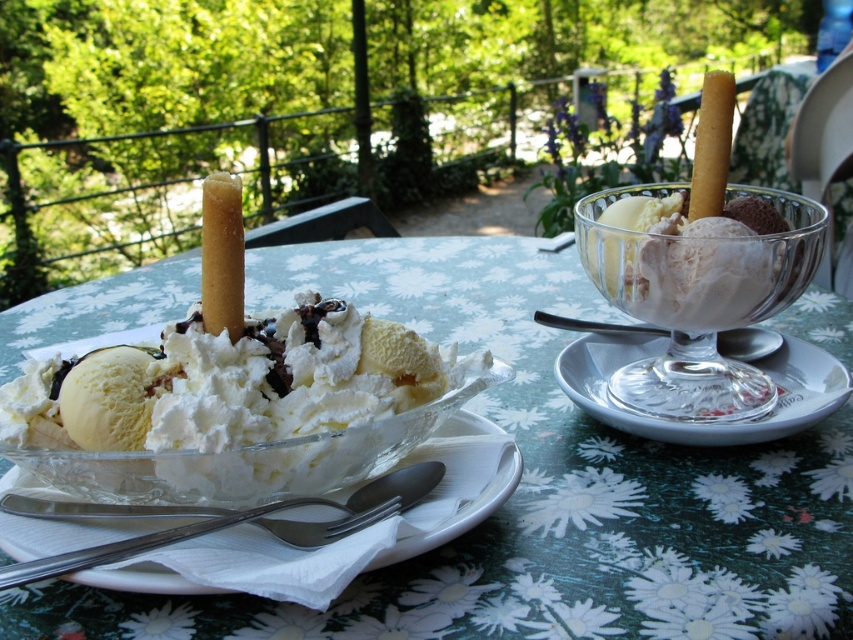
You are at a picnic table and want to place your napkin on the white glass saucer at right. However, the soft vanilla ice cream at left is currently covering it. Can you put the napkin there without moving the ice cream?

The soft vanilla ice cream at left is positioned over white glass saucer at right, so you cannot place the napkin on the white glass saucer at right without moving the ice cream first.

You are sitting at the table and want to grab the clear glass bowl at center. Which direction should you reach to avoid knocking over the transparent glass bowl at center right?

The clear glass bowl at center is in front of the transparent glass bowl at center right, so you should reach forward to grab the clear glass bowl at center without disturbing the one behind it.

You are at a picnic table and want to grab the soft vanilla ice cream at left. The coordinates given are in a normalized system where the bottom left corner is the origin. Can you confirm if the point at (239, 410) is indeed the location of the soft vanilla ice cream at left?

Yes, the point at (239, 410) is indeed the location of the soft vanilla ice cream at left as stated in the Objects Description.